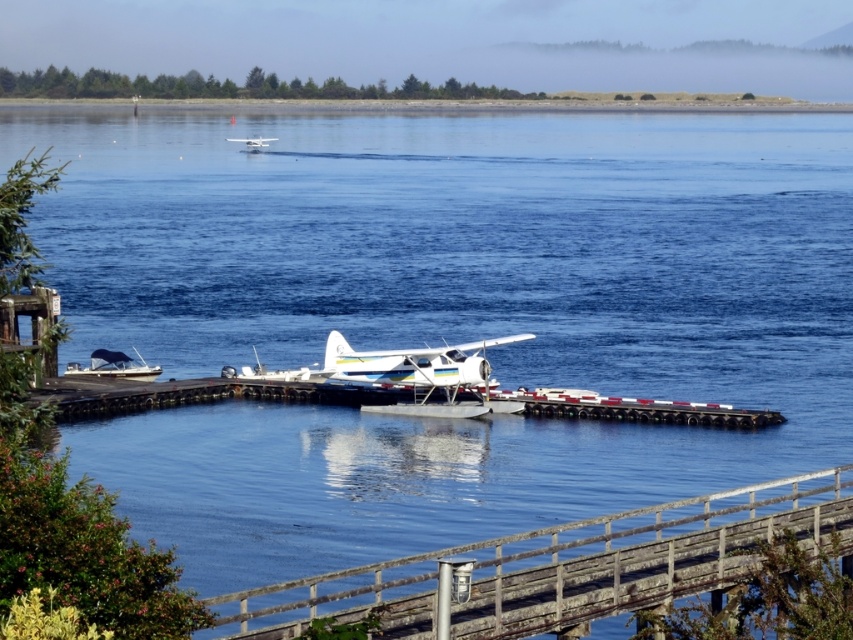
Question: Which point is closer to the camera?

Choices:
 (A) (392, 349)
 (B) (102, 372)
 (C) (653, 598)

Answer: (C)

Question: Which is nearer to the white matte boat at lower left?

Choices:
 (A) white wood dock at center
 (B) white matte seaplane at center

Answer: (A)

Question: Estimate the real-world distances between objects in this image. Which object is closer to the white wood dock at center?

Choices:
 (A) white matte seaplane at upper center
 (B) wooden at lower center
 (C) white matte boat at lower left
 (D) white matte seaplane at center

Answer: (C)

Question: Is wooden at lower center smaller than white matte seaplane at center?

Choices:
 (A) no
 (B) yes

Answer: (A)

Question: Is the position of white wood dock at center more distant than that of white matte seaplane at upper center?

Choices:
 (A) no
 (B) yes

Answer: (A)

Question: Does white wood dock at center appear on the right side of white matte seaplane at center?

Choices:
 (A) no
 (B) yes

Answer: (B)